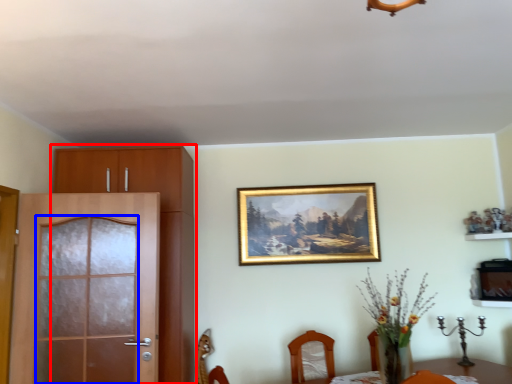
Question: Which object appears closest to the camera in this image, cabinetry (highlighted by a red box) or screen door (highlighted by a blue box)?

Choices:
 (A) cabinetry
 (B) screen door

Answer: (B)